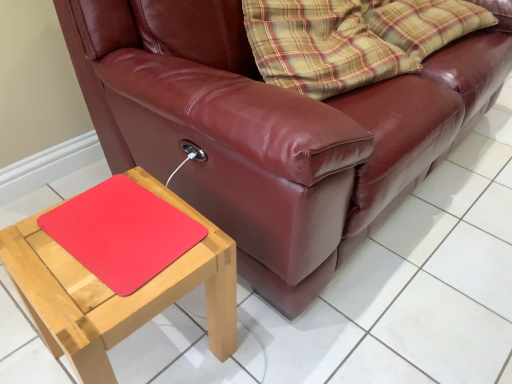
The width and height of the screenshot is (512, 384). What are the coordinates of `vacant space to the right of natural wood table at lower left` in the screenshot? It's located at (278, 339).